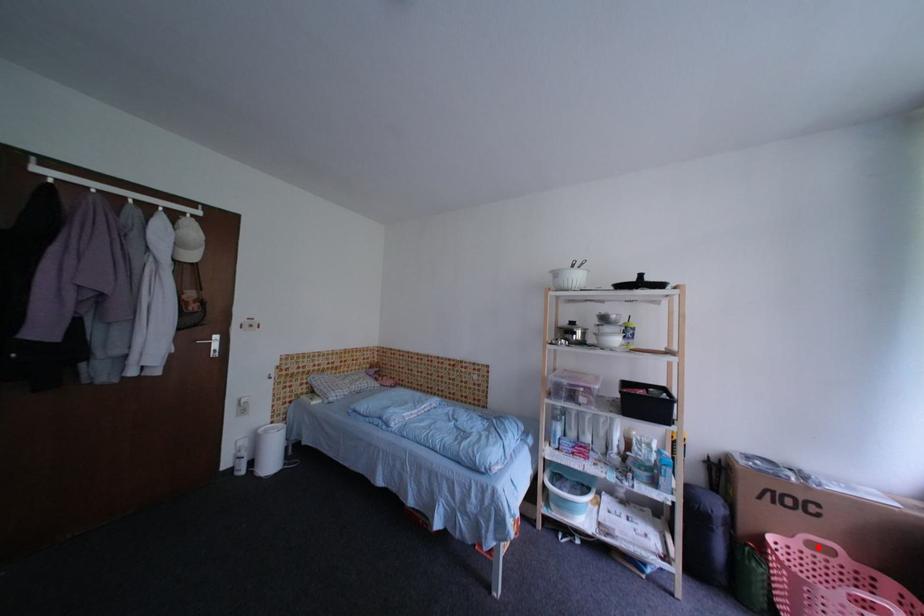
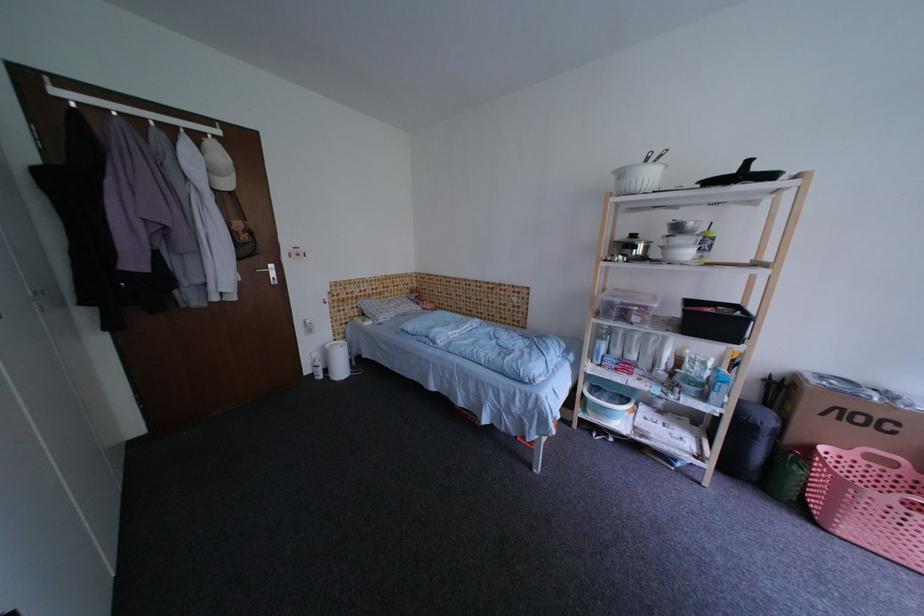
Locate, in the second image, the point that corresponds to the highlighted location in the first image.

(878, 459)